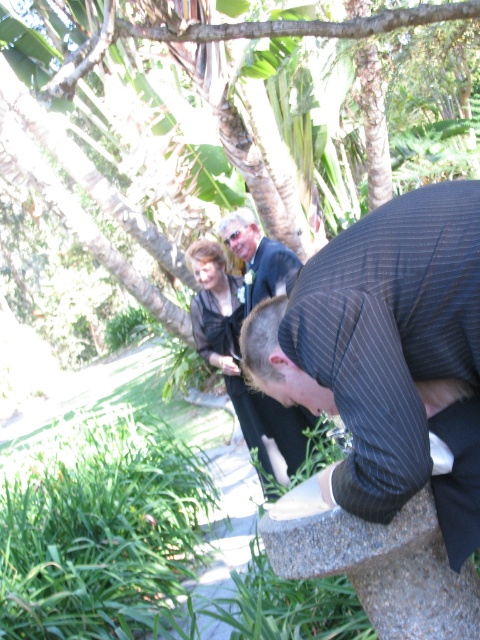
Based on the scene description, which object is positioned higher relative to the other? Please refer to the objects listed below and answer accordingly. Objects to consider are the green leafy tree at upper center and the dark gray fabric dress at center.

The green leafy tree at upper center is positioned above the dark gray fabric dress at center.

You are standing at the point with coordinates point (276, 416) and want to walk to the point with coordinates point (389, 298). Which direction should you face to walk towards your destination?

You should face north because point (389, 298) is in front of point (276, 416).